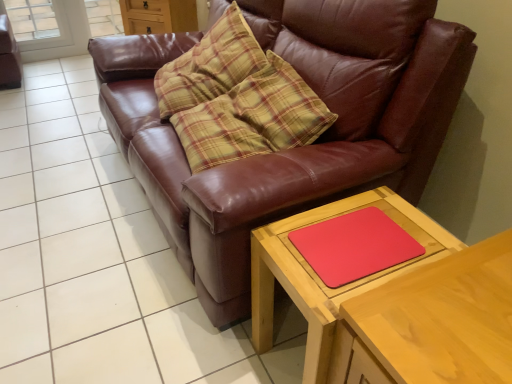
Question: Does brown leather couch at center have a greater height compared to wooden table at lower right, which is counted as the 2th table, starting from the right?

Choices:
 (A) yes
 (B) no

Answer: (A)

Question: Is brown leather couch at center facing away from wooden table at lower right, which is counted as the 2th table, starting from the right?

Choices:
 (A) no
 (B) yes

Answer: (A)

Question: Is wooden table at lower right, the first table positioned from the left, located within brown leather couch at center?

Choices:
 (A) yes
 (B) no

Answer: (B)

Question: From the image's perspective, is brown leather couch at center on top of wooden table at lower right, the first table positioned from the left?

Choices:
 (A) no
 (B) yes

Answer: (B)

Question: Does brown leather couch at center appear on the right side of wooden table at lower right, the first table positioned from the left?

Choices:
 (A) no
 (B) yes

Answer: (A)

Question: In terms of width, does wooden table at lower right, which is the 1th table from right to left, look wider or thinner when compared to matte brown dresser at upper center?

Choices:
 (A) thin
 (B) wide

Answer: (B)

Question: Considering the positions of wooden table at lower right, placed as the second table when sorted from left to right, and matte brown dresser at upper center in the image, is wooden table at lower right, placed as the second table when sorted from left to right, taller or shorter than matte brown dresser at upper center?

Choices:
 (A) tall
 (B) short

Answer: (A)

Question: From the image's perspective, is wooden table at lower right, placed as the second table when sorted from left to right, above or below matte brown dresser at upper center?

Choices:
 (A) above
 (B) below

Answer: (B)

Question: From a real-world perspective, is wooden table at lower right, which is the 1th table from right to left, above or below matte brown dresser at upper center?

Choices:
 (A) above
 (B) below

Answer: (B)

Question: In terms of width, does matte brown swivel chair at upper left look wider or thinner when compared to brown leather couch at center?

Choices:
 (A) wide
 (B) thin

Answer: (B)

Question: Is point (15, 59) positioned closer to the camera than point (200, 178)?

Choices:
 (A) farther
 (B) closer

Answer: (A)

Question: Considering their positions, is matte brown swivel chair at upper left located in front of or behind brown leather couch at center?

Choices:
 (A) behind
 (B) front

Answer: (A)

Question: Is matte brown swivel chair at upper left spatially inside brown leather couch at center, or outside of it?

Choices:
 (A) outside
 (B) inside

Answer: (A)

Question: From the image's perspective, is wooden table at lower right, which is counted as the 2th table, starting from the right, located above or below brown leather couch at center?

Choices:
 (A) above
 (B) below

Answer: (B)

Question: Would you say wooden table at lower right, the first table positioned from the left, is to the left or to the right of brown leather couch at center in the picture?

Choices:
 (A) right
 (B) left

Answer: (A)